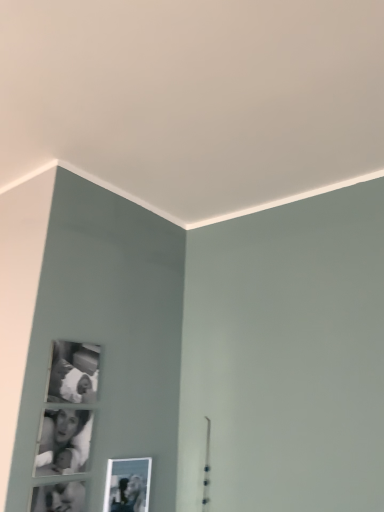
Question: Is point (66, 347) positioned closer to the camera than point (57, 464)?

Choices:
 (A) farther
 (B) closer

Answer: (A)

Question: From a real-world perspective, is black matte photo frame at upper left, which is the 2th picture frame in bottom-to-top order, physically located above or below black glossy photo frame at lower left?

Choices:
 (A) above
 (B) below

Answer: (A)

Question: Estimate the real-world distances between objects in this image. Which object is farther from the metallic silver photo frame at lower center, which appears as the first picture frame when viewed from the right?

Choices:
 (A) black glossy photo frame at lower left
 (B) black matte photo frame at upper left, positioned as the 1th picture frame in top-to-bottom order

Answer: (B)

Question: Which object is positioned farthest from the black glossy photo frame at lower left?

Choices:
 (A) black matte photo frame at upper left, arranged as the first picture frame when viewed from the left
 (B) metallic silver photo frame at lower center, the first picture frame in the bottom-to-top sequence

Answer: (B)